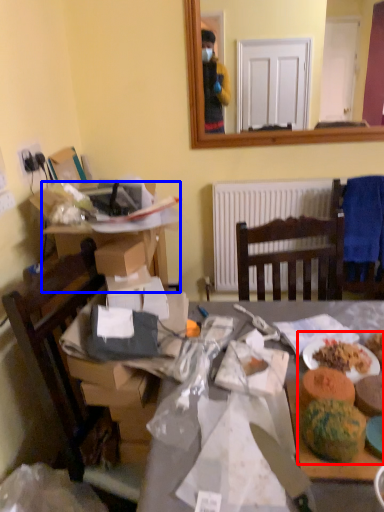
Question: Which of the following is the closest to the observer, food (highlighted by a red box) or desk (highlighted by a blue box)?

Choices:
 (A) food
 (B) desk

Answer: (A)